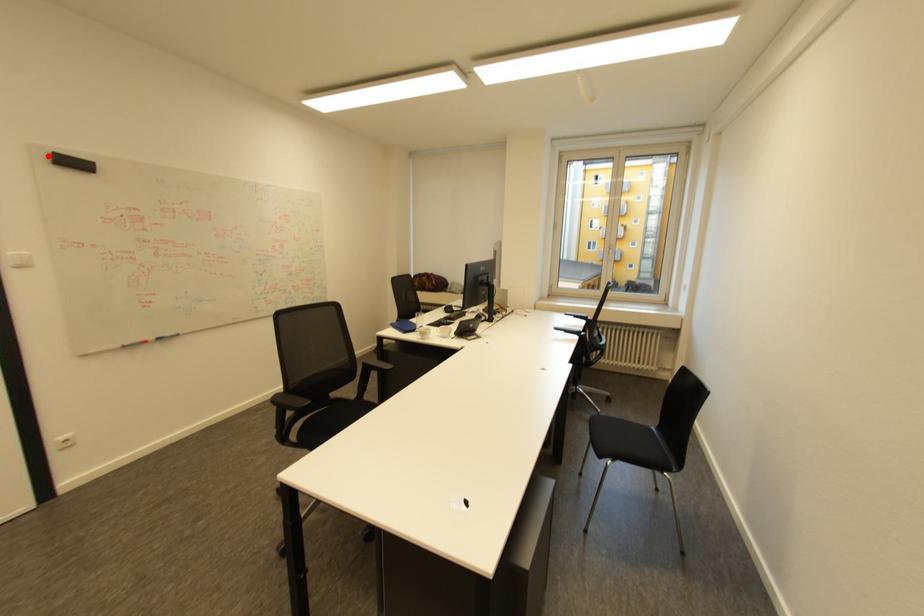
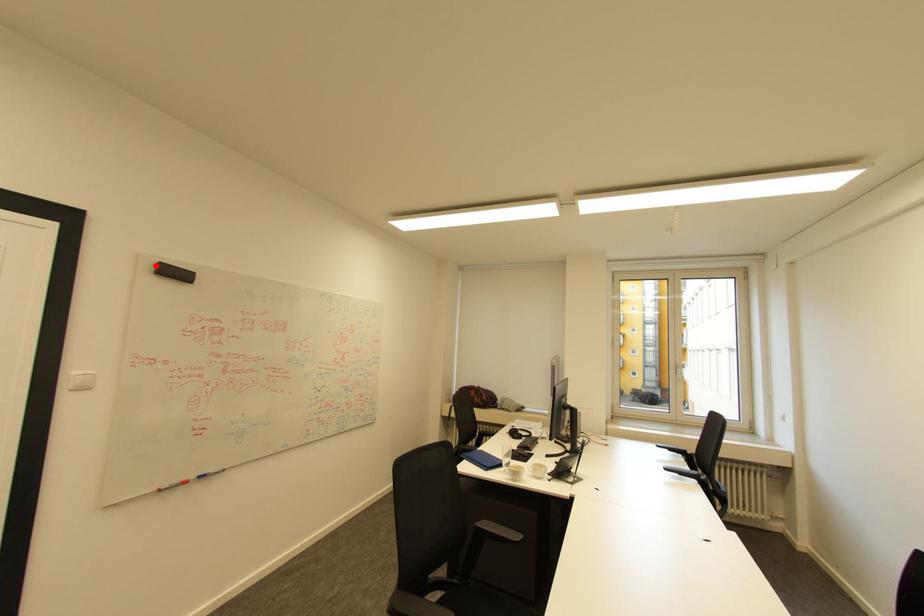
From the picture: I am providing you with two images of the same scene from different viewpoints. A red point is marked on the first image and another point is marked on the second image. Is the marked point in image1 the same physical position as the marked point in image2?

Yes